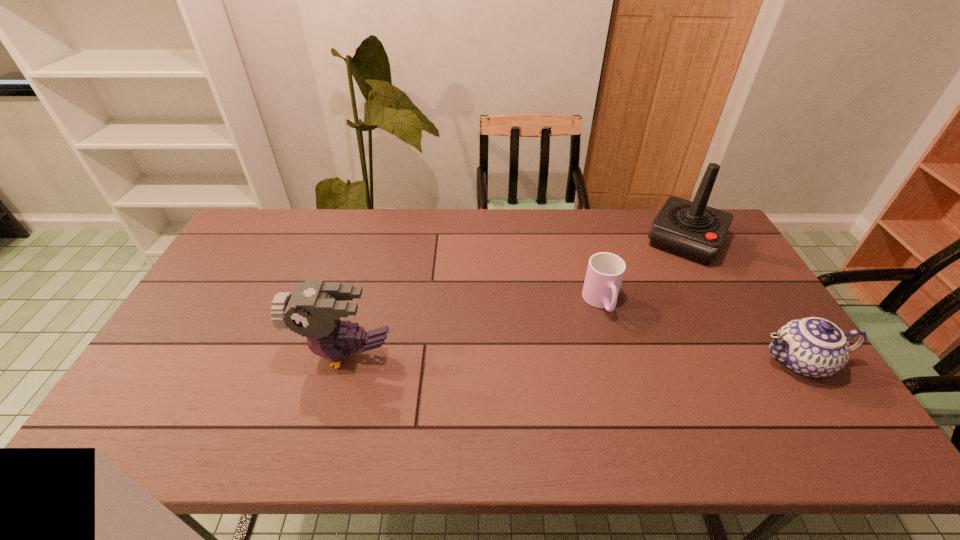
This screenshot has height=540, width=960. What are the coordinates of `object present at the near edge` in the screenshot? It's located at (813, 347).

Locate an element on the screen. This screenshot has width=960, height=540. chinaware that is at the right edge is located at coordinates (813, 347).

Identify the location of joystick situated at the right edge. (692, 230).

Locate an element on the screen. This screenshot has width=960, height=540. object that is at the far right corner is located at coordinates (692, 230).

What are the coordinates of `object that is at the near right corner` in the screenshot? It's located at (813, 347).

Image resolution: width=960 pixels, height=540 pixels. In the image, there is a desktop. Identify the location of vacant space at the far edge. (639, 220).

In the image, there is a desktop. At what (x,y) coordinates should I click in order to perform the action: click on vacant area at the near edge. Please return your answer as a coordinate pair (x, y). Looking at the image, I should click on (744, 382).

Where is `free space at the left edge of the desktop`? free space at the left edge of the desktop is located at coordinates (239, 253).

The image size is (960, 540). What are the coordinates of `vacant region at the right edge` in the screenshot? It's located at (721, 293).

The width and height of the screenshot is (960, 540). Find the location of `vacant space at the far left corner of the desktop`. vacant space at the far left corner of the desktop is located at coordinates (253, 211).